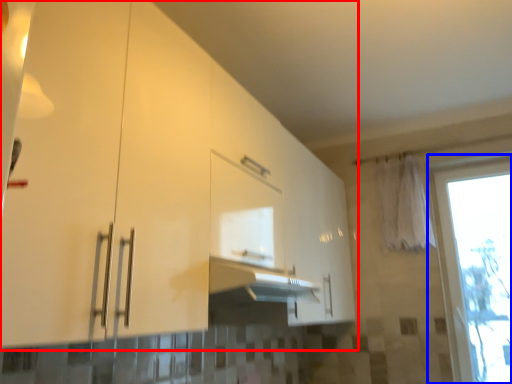
Question: Which point is further to the camera, cabinetry (highlighted by a red box) or window (highlighted by a blue box)?

Choices:
 (A) cabinetry
 (B) window

Answer: (B)